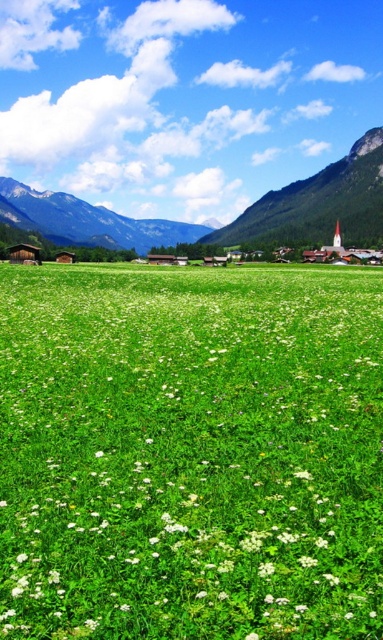
Question: Which point is closer to the camera?

Choices:
 (A) green rocky mountain at upper right
 (B) green grassy mountain at upper left

Answer: (B)

Question: Which of the following is the farthest from the observer?

Choices:
 (A) white matte flower at center
 (B) green grassy mountain at upper left
 (C) green rocky mountain at upper right

Answer: (C)

Question: Does green rocky mountain at upper right appear under green grassy mountain at upper left?

Choices:
 (A) yes
 (B) no

Answer: (A)

Question: Which object is the closest to the green grassy mountain at upper left?

Choices:
 (A) white matte flower at center
 (B) green rocky mountain at upper right

Answer: (B)

Question: Is green rocky mountain at upper right smaller than green grassy mountain at upper left?

Choices:
 (A) yes
 (B) no

Answer: (A)

Question: Is green rocky mountain at upper right bigger than green grassy mountain at upper left?

Choices:
 (A) yes
 (B) no

Answer: (B)